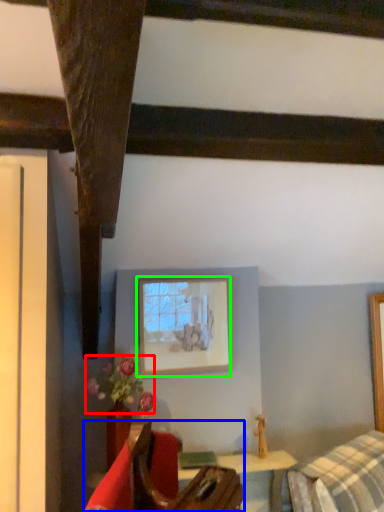
Question: Estimate the real-world distances between objects in this image. Which object is farther from flower (highlighted by a red box), furniture (highlighted by a blue box) or picture frame (highlighted by a green box)?

Choices:
 (A) furniture
 (B) picture frame

Answer: (A)